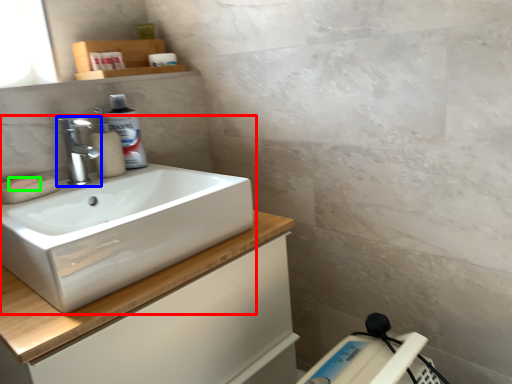
Question: Based on their relative distances, which object is farther from sink (highlighted by a red box)? Choose from tap (highlighted by a blue box) and soap (highlighted by a green box).

Choices:
 (A) tap
 (B) soap

Answer: (B)